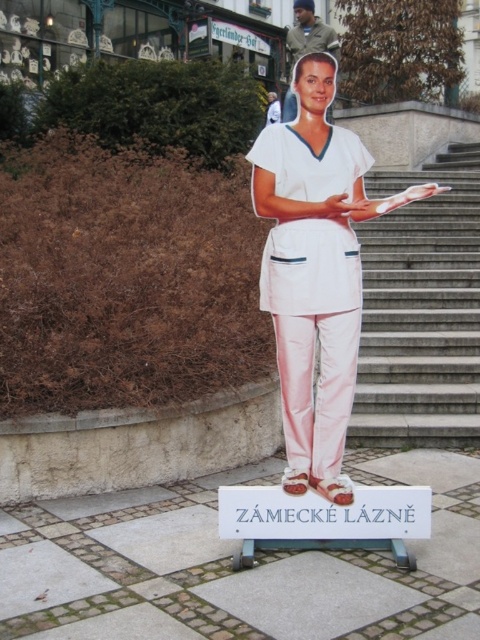
Question: Does smooth concrete stairs at center come behind white smooth uniform at center?

Choices:
 (A) no
 (B) yes

Answer: (B)

Question: Does smooth concrete stairs at center appear on the left side of white smooth uniform at center?

Choices:
 (A) yes
 (B) no

Answer: (B)

Question: Does smooth concrete stairs at center appear over white smooth uniform at center?

Choices:
 (A) yes
 (B) no

Answer: (A)

Question: Which point is closer to the camera?

Choices:
 (A) (x=376, y=250)
 (B) (x=266, y=307)

Answer: (B)

Question: Which point is closer to the camera?

Choices:
 (A) smooth concrete stairs at center
 (B) white smooth uniform at center

Answer: (B)